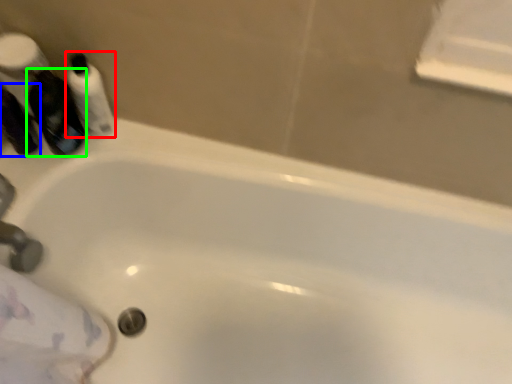
Question: Which object is positioned farthest from mouthwash (highlighted by a red box)? Select from mouthwash (highlighted by a blue box) and mouthwash (highlighted by a green box).

Choices:
 (A) mouthwash
 (B) mouthwash

Answer: (A)